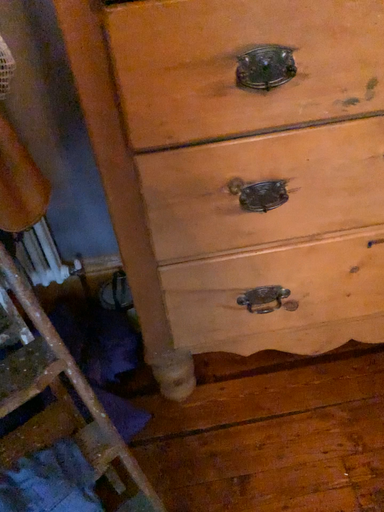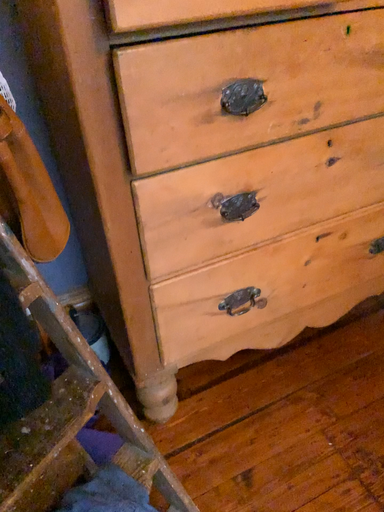
Question: Which way did the camera rotate in the video?

Choices:
 (A) rotated left
 (B) rotated right

Answer: (B)